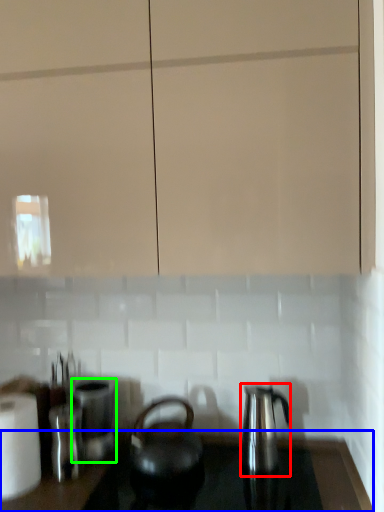
Question: Considering the real-world distances, which object is closest to kettle (highlighted by a red box)? counter top (highlighted by a blue box) or appliance (highlighted by a green box).

Choices:
 (A) counter top
 (B) appliance

Answer: (A)